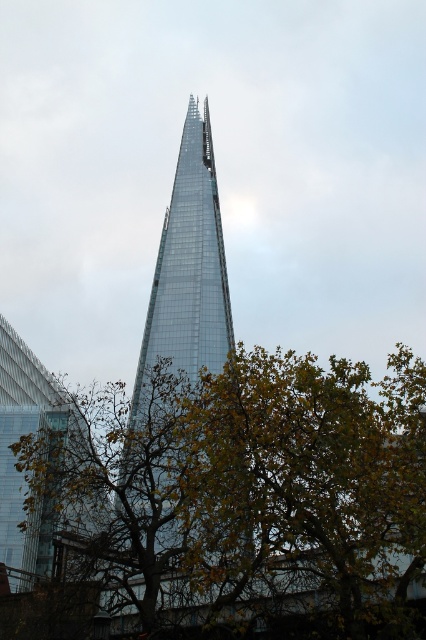
Does green leafy tree at center lie behind transparent glass tower at left?

No, it is not.

Which is behind, point (417, 376) or point (29, 374)?

The point (29, 374) is more distant.

Locate an element on the screen. This screenshot has width=426, height=640. green leafy tree at center is located at coordinates (247, 493).